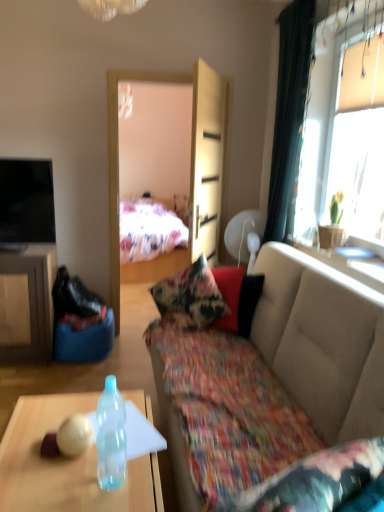
Question: From their relative heights in the image, would you say transparent glass table at upper right is taller or shorter than transparent plastic bottle at lower left?

Choices:
 (A) tall
 (B) short

Answer: (B)

Question: From the image's perspective, relative to transparent plastic bottle at lower left, is transparent glass table at upper right above or below?

Choices:
 (A) above
 (B) below

Answer: (A)

Question: Considering the real-world distances, which object is farthest from the light wood armoire at center?

Choices:
 (A) floral fabric couch at center
 (B) transparent plastic bottle at lower left
 (C) transparent glass table at upper right
 (D) black fabric curtain at right
 (E) black glossy tv at upper left

Answer: (B)

Question: Based on their relative distances, which object is nearer to the green fabric plant at right?

Choices:
 (A) transparent glass table at upper right
 (B) light wood armoire at center
 (C) floral fabric couch at center
 (D) transparent plastic bottle at lower left
 (E) transparent plastic bottle at lower left

Answer: (A)